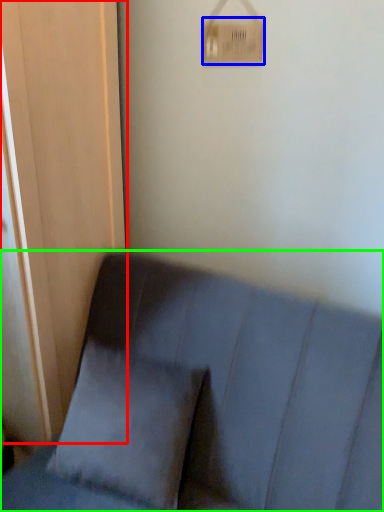
Question: Which object is positioned farthest from screen door (highlighted by a red box)? Select from light switch (highlighted by a blue box) and furniture (highlighted by a green box).

Choices:
 (A) light switch
 (B) furniture

Answer: (A)